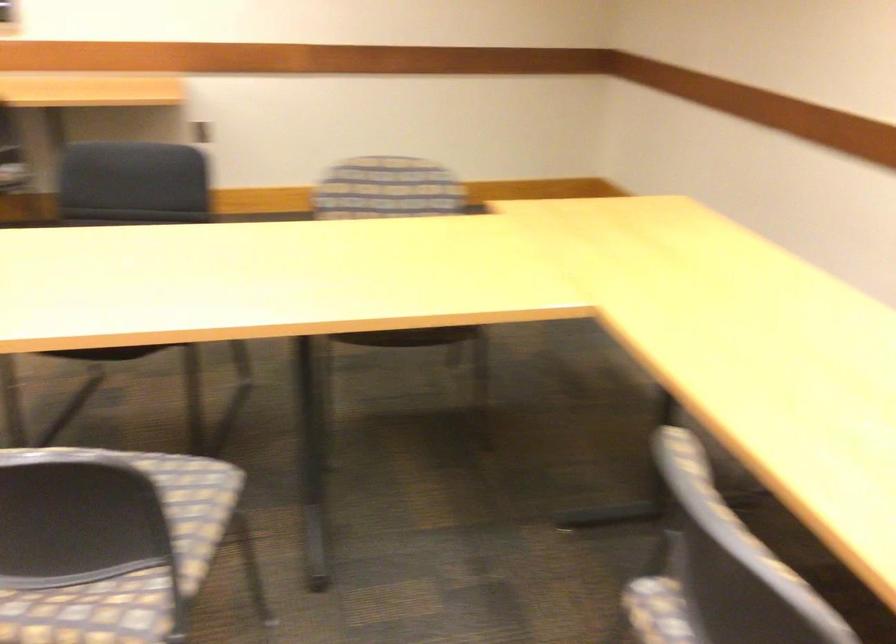
Image resolution: width=896 pixels, height=644 pixels. I want to click on black chair sitting surface, so click(106, 353).